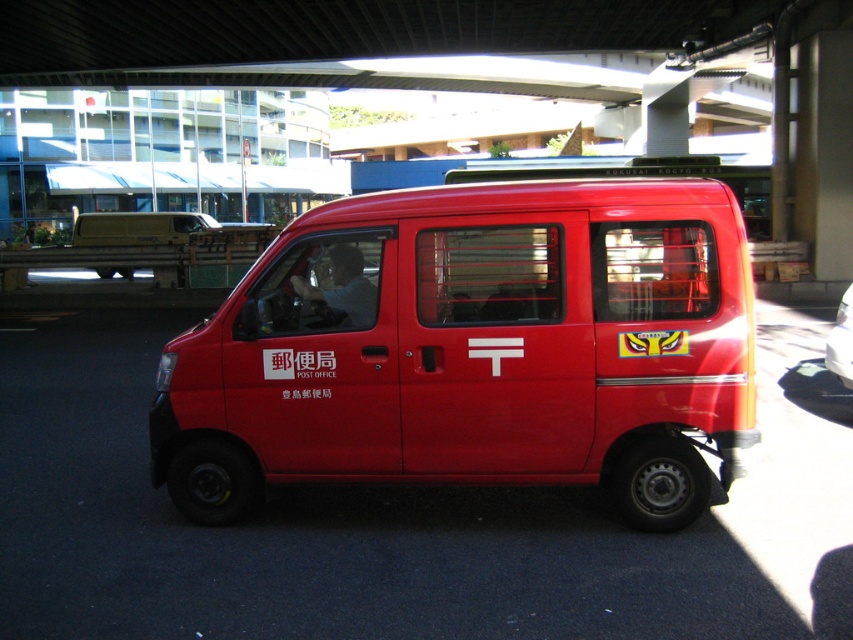
You are a delivery person who needs to load a package onto the matte red van at center and the matte yellow van at left. Which van requires a shorter loading ramp due to its height?

The matte red van at center requires a shorter loading ramp because it is not as tall as the matte yellow van at left.

You are a delivery driver who needs to park your vehicle under an overpass. You have two options, the matte yellow van at left and the metallic red van at center. Based on their heights, which van would be safer to park under the overpass?

The matte yellow van at left is taller than the metallic red van at center, so the metallic red van at center would be safer to park under the overpass since it has a lower height.